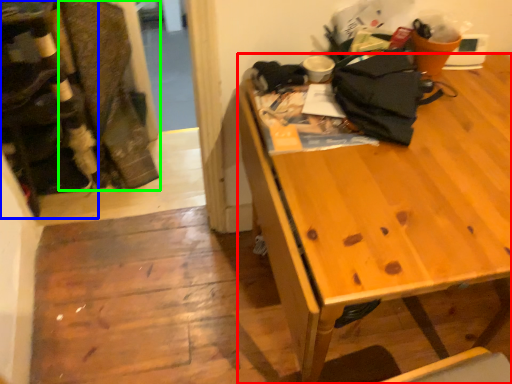
Question: Which is nearer to the desk (highlighted by a red box)? leftover (highlighted by a blue box) or laundry (highlighted by a green box).

Choices:
 (A) leftover
 (B) laundry

Answer: (A)